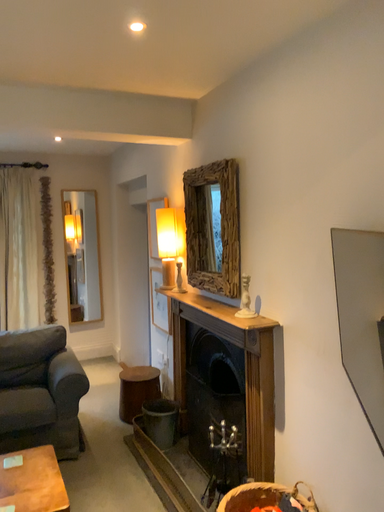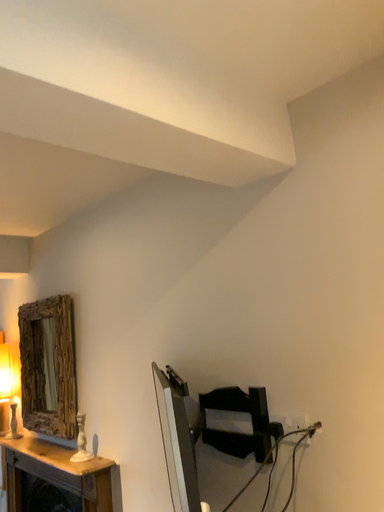
Question: How did the camera likely rotate when shooting the video?

Choices:
 (A) rotated right
 (B) rotated left

Answer: (A)